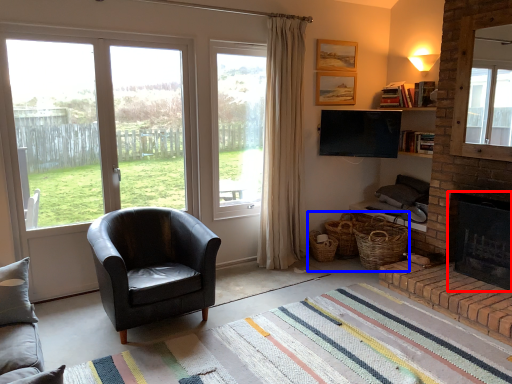
Question: Which of the following is the farthest to the observer, fireplace (highlighted by a red box) or basket (highlighted by a blue box)?

Choices:
 (A) fireplace
 (B) basket

Answer: (B)